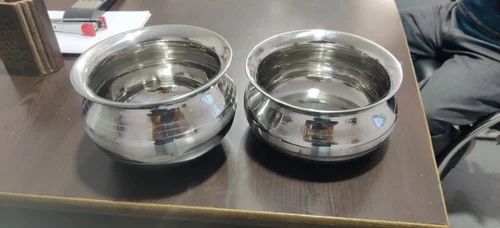
Image resolution: width=500 pixels, height=228 pixels. Identify the location of lines on table. (333, 198), (330, 197), (312, 192), (303, 195), (300, 197).